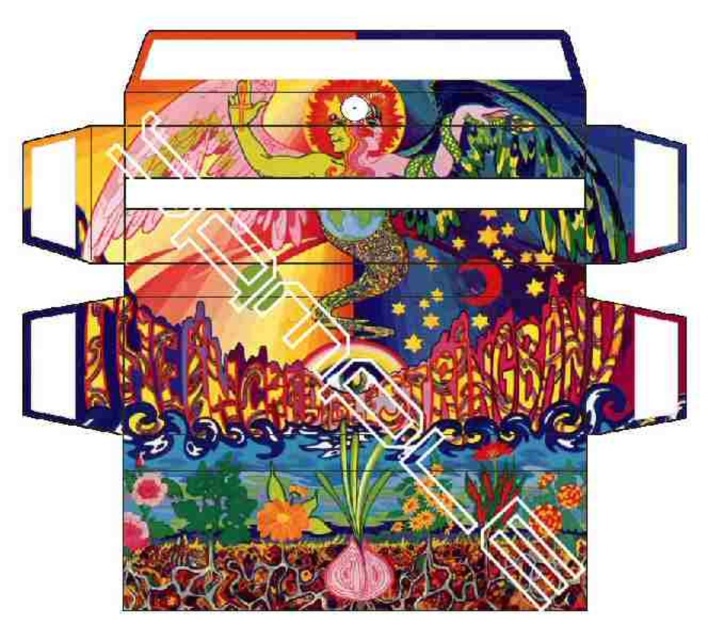
Question: Which of the following is the closest to the observer?

Choices:
 (A) (573, 484)
 (B) (142, 476)

Answer: (B)

Question: Can you confirm if matte orange flower at lower center is positioned to the right of orange matte flower at center?

Choices:
 (A) no
 (B) yes

Answer: (A)

Question: Can you confirm if matte orange flower at lower center is positioned to the left of orange matte flower at center?

Choices:
 (A) yes
 (B) no

Answer: (A)

Question: Among these points, which one is nearest to the camera?

Choices:
 (A) [142, 547]
 (B) [147, 484]
 (C) [571, 486]

Answer: (A)

Question: Is the position of matte pink flower at lower center less distant than that of matte pink flower at lower left?

Choices:
 (A) yes
 (B) no

Answer: (B)

Question: Which object is closer to the camera taking this photo?

Choices:
 (A) matte orange flower at lower center
 (B) matte pink flower at lower left

Answer: (B)